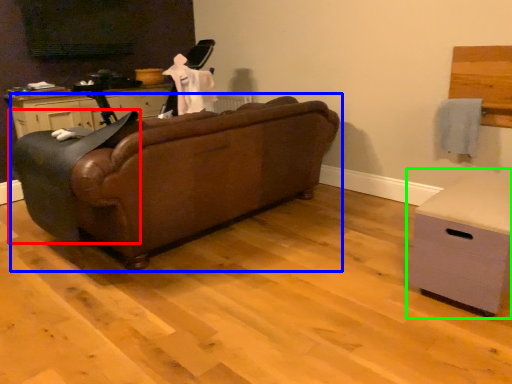
Question: Estimate the real-world distances between objects in this image. Which object is closer to rocking chair (highlighted by a red box), studio couch (highlighted by a blue box) or chest of drawers (highlighted by a green box)?

Choices:
 (A) studio couch
 (B) chest of drawers

Answer: (A)